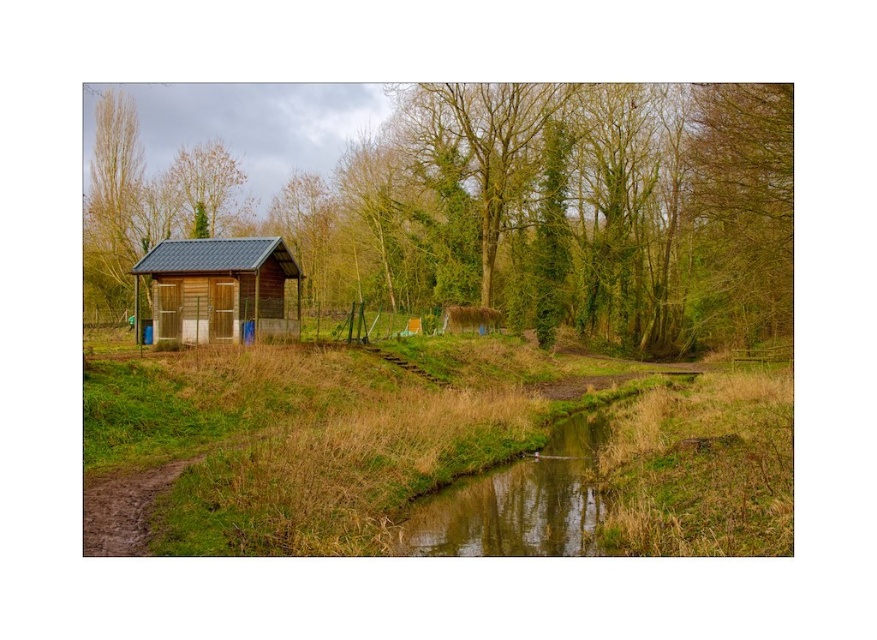
You are standing at the entrance of the shed and looking towards the upper part of the image. Which tree is positioned to the right of the other between the green leafy tree at upper center and the brown textured tree at upper left?

The green leafy tree at upper center is positioned to the right of the brown textured tree at upper left.

You are standing at the entrance of the shed and want to walk towards the green leafy tree at upper center and the brown textured tree at upper left. Which tree will you reach first?

You will reach the green leafy tree at upper center first because it is closer to you than the brown textured tree at upper left.

You are standing at the entrance of the shed and want to walk towards the green leafy tree at upper left and the brown textured tree at upper left. Which tree will you reach first?

The green leafy tree at upper left and brown textured tree at upper left are both located at the upper left of the scene. Since they are the same distance from your current position at the shed entrance, you will reach both trees at the same time.